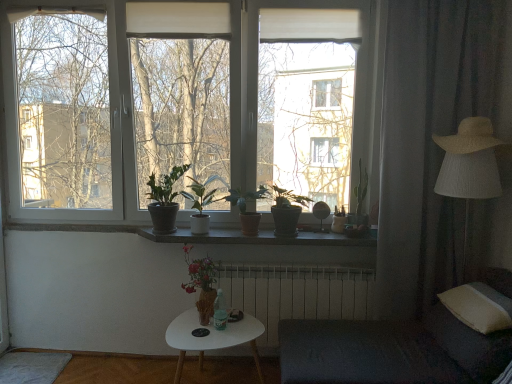
Question: Which direction should I rotate to face matte brown vase at center, the third houseplant viewed from the left, — up or down?

Choices:
 (A) down
 (B) up

Answer: (A)

Question: Does white matte coffee table at lower center have a greater height compared to green matte cactus at upper right?

Choices:
 (A) no
 (B) yes

Answer: (A)

Question: Is white matte coffee table at lower center positioned with its back to green matte cactus at upper right?

Choices:
 (A) yes
 (B) no

Answer: (B)

Question: Could you tell me if white matte coffee table at lower center is facing green matte cactus at upper right?

Choices:
 (A) yes
 (B) no

Answer: (B)

Question: Does white matte coffee table at lower center appear on the left side of green matte cactus at upper right?

Choices:
 (A) yes
 (B) no

Answer: (A)

Question: Is the depth of white matte coffee table at lower center less than that of green matte cactus at upper right?

Choices:
 (A) yes
 (B) no

Answer: (A)

Question: Can you confirm if white matte coffee table at lower center is smaller than green matte cactus at upper right?

Choices:
 (A) no
 (B) yes

Answer: (A)

Question: Can you confirm if gray fabric curtain at right is shorter than white soft pillow at lower right?

Choices:
 (A) yes
 (B) no

Answer: (B)

Question: Can you confirm if gray fabric curtain at right is positioned to the right of white soft pillow at lower right?

Choices:
 (A) yes
 (B) no

Answer: (B)

Question: Is gray fabric curtain at right further to camera compared to white soft pillow at lower right?

Choices:
 (A) no
 (B) yes

Answer: (B)

Question: Is gray fabric curtain at right at the left side of white soft pillow at lower right?

Choices:
 (A) yes
 (B) no

Answer: (A)

Question: Could you tell me if gray fabric curtain at right is turned towards white soft pillow at lower right?

Choices:
 (A) no
 (B) yes

Answer: (B)

Question: From a real-world perspective, is gray fabric curtain at right over white soft pillow at lower right?

Choices:
 (A) yes
 (B) no

Answer: (A)

Question: Does strawmaterial/texturehat at right have a lesser height compared to white metallic radiator at center?

Choices:
 (A) no
 (B) yes

Answer: (B)